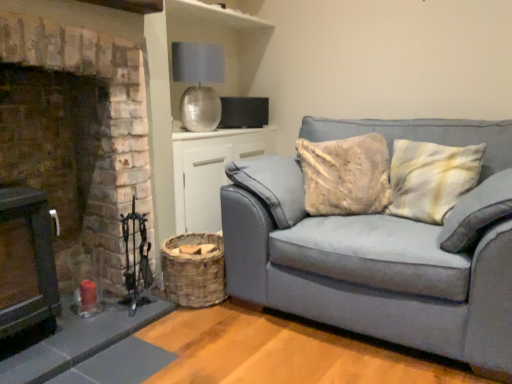
Question: Are brick fireplace at left and metallic silver lampshade at upper center beside each other?

Choices:
 (A) no
 (B) yes

Answer: (A)

Question: Is brick fireplace at left at the right side of metallic silver lampshade at upper center?

Choices:
 (A) no
 (B) yes

Answer: (A)

Question: Can you confirm if brick fireplace at left is smaller than metallic silver lampshade at upper center?

Choices:
 (A) no
 (B) yes

Answer: (A)

Question: Could you tell me if brick fireplace at left is facing metallic silver lampshade at upper center?

Choices:
 (A) no
 (B) yes

Answer: (A)

Question: Is brick fireplace at left far away from metallic silver lampshade at upper center?

Choices:
 (A) yes
 (B) no

Answer: (B)

Question: From a real-world perspective, is brick fireplace at left positioned above or below suede gray couch at right?

Choices:
 (A) below
 (B) above

Answer: (B)

Question: Based on their positions, is brick fireplace at left located to the left or right of suede gray couch at right?

Choices:
 (A) right
 (B) left

Answer: (B)

Question: From the image's perspective, relative to suede gray couch at right, is brick fireplace at left above or below?

Choices:
 (A) above
 (B) below

Answer: (A)

Question: Looking at the image, does brick fireplace at left seem bigger or smaller compared to suede gray couch at right?

Choices:
 (A) big
 (B) small

Answer: (B)

Question: Looking at their shapes, would you say woven wood basket at lower center is wider or thinner than metallic silver lampshade at upper center?

Choices:
 (A) thin
 (B) wide

Answer: (B)

Question: Relative to metallic silver lampshade at upper center, is woven wood basket at lower center in front or behind?

Choices:
 (A) front
 (B) behind

Answer: (A)

Question: Considering the positions of point coord(206,175) and point coord(220,66), is point coord(206,175) closer or farther from the camera than point coord(220,66)?

Choices:
 (A) closer
 (B) farther

Answer: (A)

Question: From the image's perspective, is woven wood basket at lower center above or below metallic silver lampshade at upper center?

Choices:
 (A) below
 (B) above

Answer: (A)

Question: In terms of size, does woven wood basket at lower center appear bigger or smaller than woven brown basket at lower left?

Choices:
 (A) big
 (B) small

Answer: (A)

Question: Is point (200, 190) positioned closer to the camera than point (202, 236)?

Choices:
 (A) closer
 (B) farther

Answer: (B)